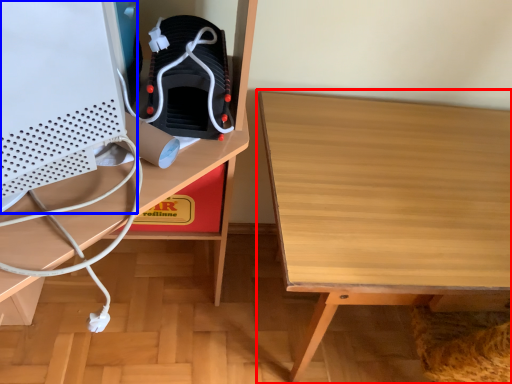
Question: Which object is further to the camera taking this photo, table (highlighted by a red box) or desktop computer (highlighted by a blue box)?

Choices:
 (A) table
 (B) desktop computer

Answer: (A)